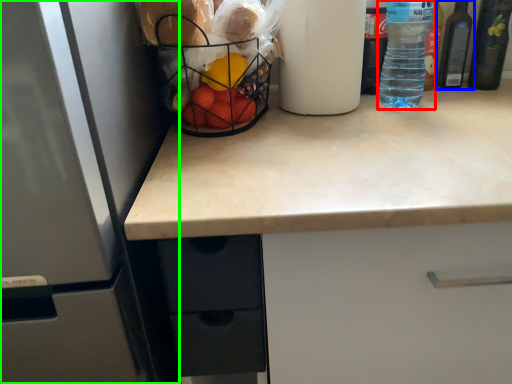
Question: Which object is positioned farthest from bottle (highlighted by a red box)? Select from bottle (highlighted by a blue box) and refrigerator (highlighted by a green box).

Choices:
 (A) bottle
 (B) refrigerator

Answer: (B)